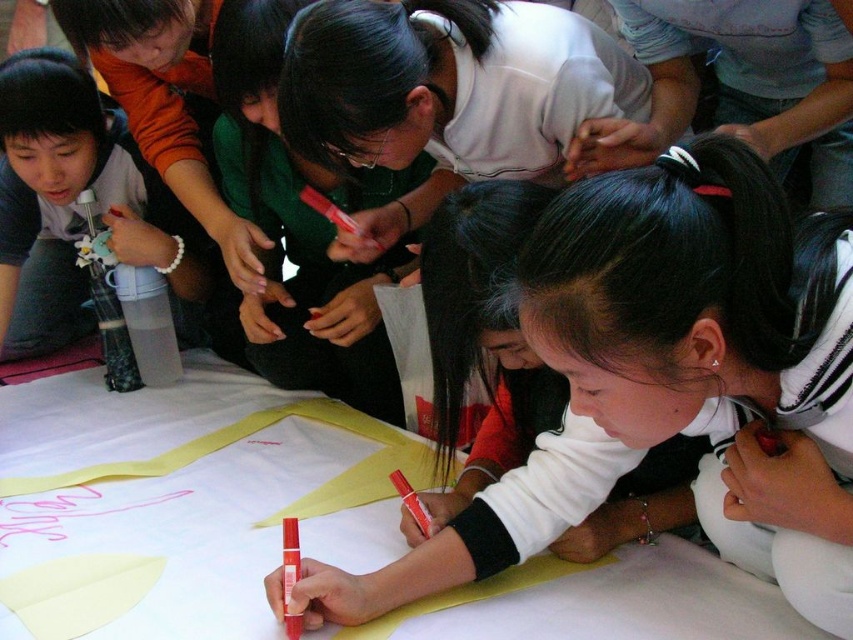
You are a teacher observing the group at the table. You notice the matte white marker at center and the white matte shirt at center. Which object is taller?

The matte white marker at center is taller than the white matte shirt at center.

You are an artist trying to choose between the matte white marker at center and the white matte shirt at center for your project. Which item is wider?

The matte white marker at center might be wider than white matte shirt at center.

In the scene shown: You are a teacher observing a group of students working at a table. You notice a matte white marker at center and a white matte shirt at center. Can you determine if the distance between these two items is sufficient for a student to comfortably reach from the shirt to the marker without moving their body? Please provide your answer based on the given information.

The matte white marker at center and white matte shirt at center are 7.69 inches apart from each other. A typical comfortable reaching distance without moving the body is around 12 inches or more, so the distance is insufficient for comfortable reach.